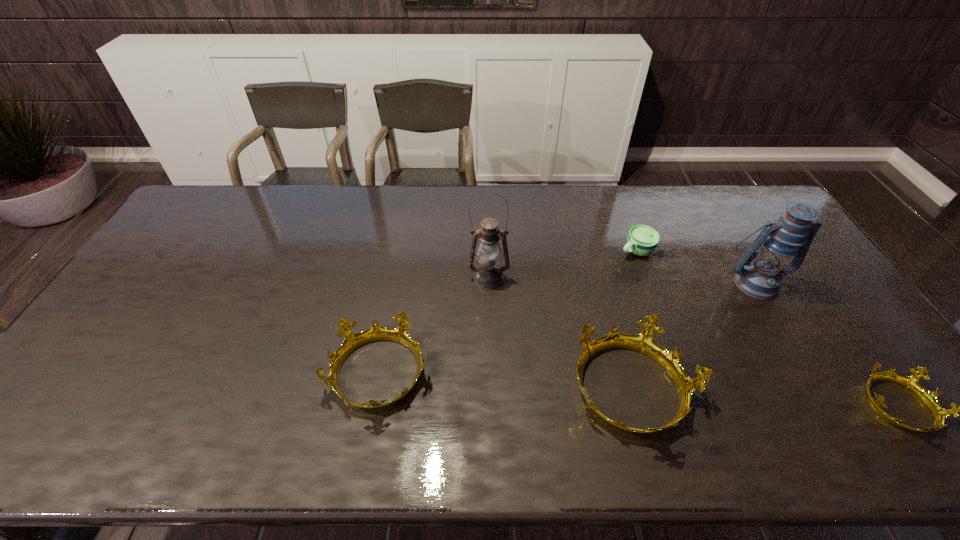
You are a GUI agent. You are given a task and a screenshot of the screen. Output one action in this format:
    pyautogui.click(x=<x>, y=<y>)
    Task: Click on the leftmost crown
    
    Given the screenshot: What is the action you would take?
    pyautogui.click(x=352, y=341)

The width and height of the screenshot is (960, 540). I want to click on the third shortest object, so click(x=352, y=341).

This screenshot has height=540, width=960. In order to click on the second crown from left to right in this screenshot , I will do `click(644, 343)`.

The height and width of the screenshot is (540, 960). I want to click on the second object from left to right, so [x=488, y=275].

The width and height of the screenshot is (960, 540). Find the location of `the farthest object`. the farthest object is located at coordinates (642, 240).

Image resolution: width=960 pixels, height=540 pixels. I want to click on lantern, so click(778, 243).

Locate an element on the screen. The image size is (960, 540). vacant space located on the right of the leftmost object is located at coordinates (521, 374).

Identify the location of vacant area located on the right of the second crown from right to left. The image size is (960, 540). (745, 390).

Where is `vacant area located on the front of the oil lamp`? This screenshot has width=960, height=540. vacant area located on the front of the oil lamp is located at coordinates (490, 313).

What are the coordinates of `free spot located on the back of the farthest object` in the screenshot? It's located at (629, 231).